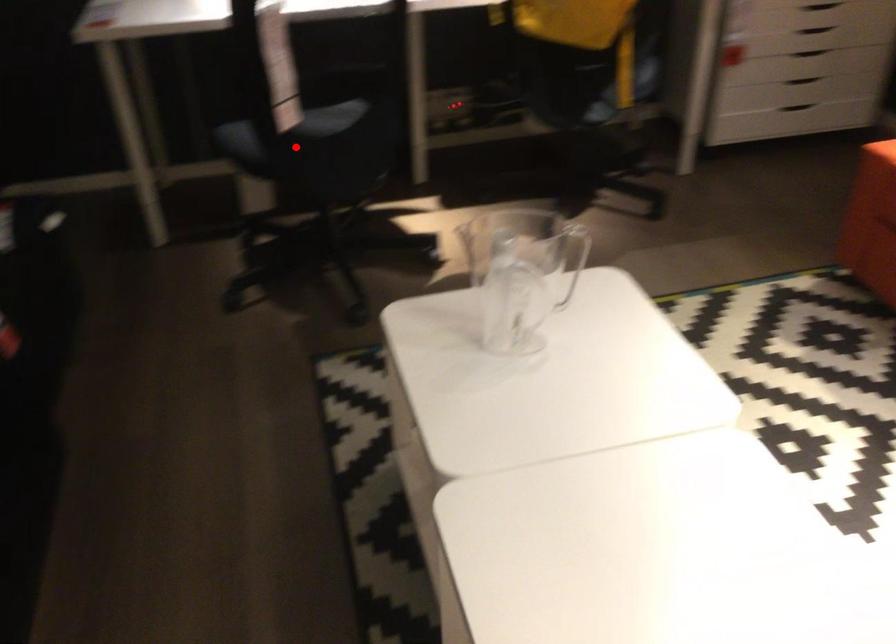
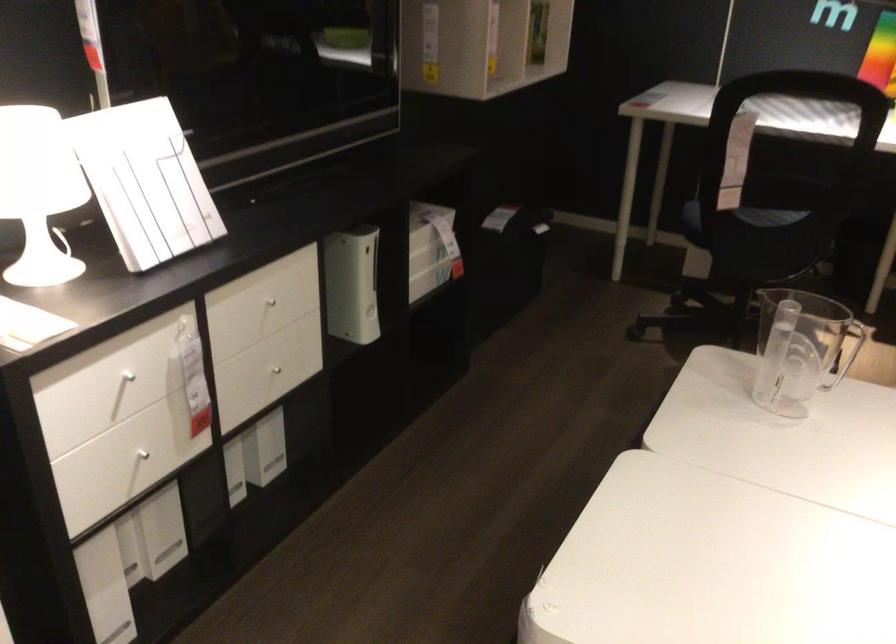
Where in the second image is the point corresponding to the highlighted location from the first image?

(739, 218)